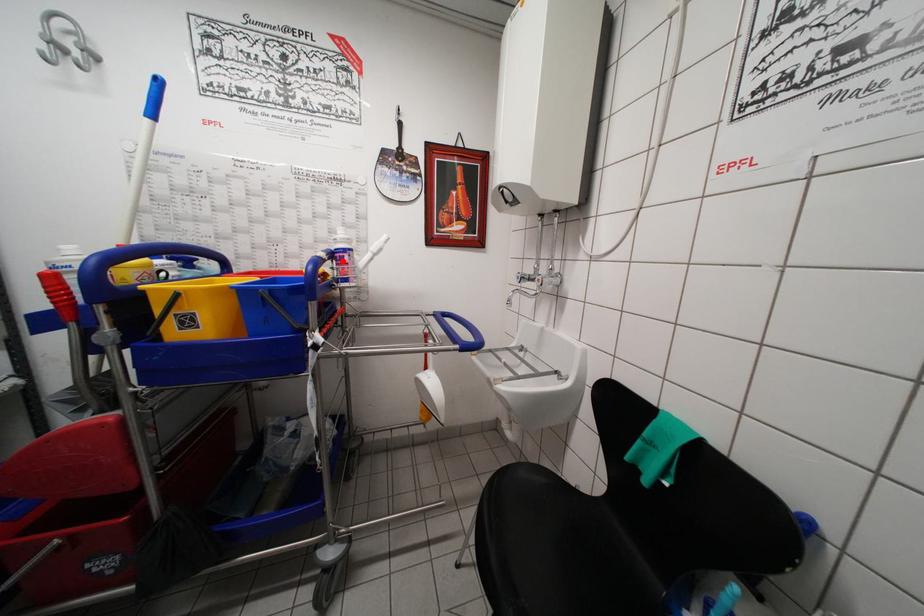
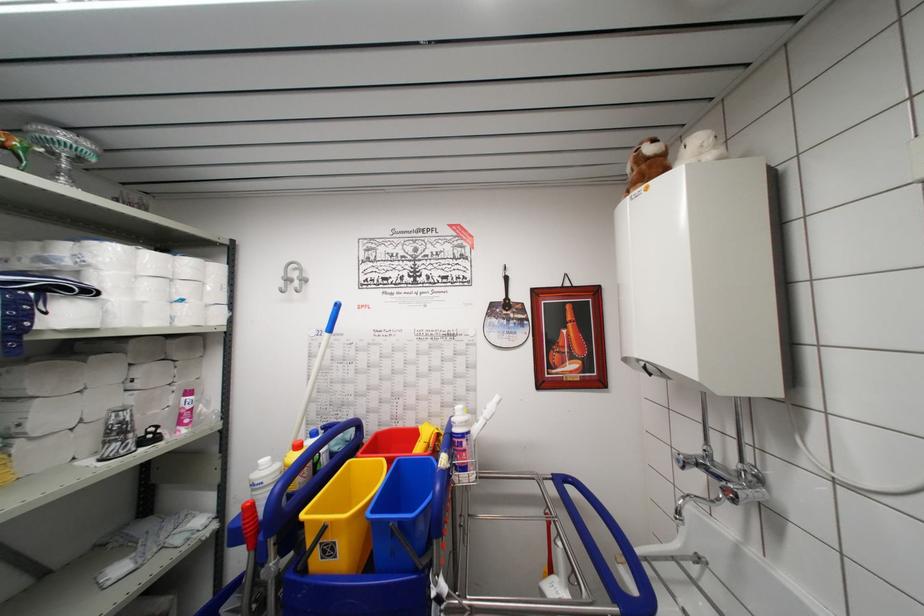
The point at the highlighted location is marked in the first image. Where is the corresponding point in the second image?

(460, 447)